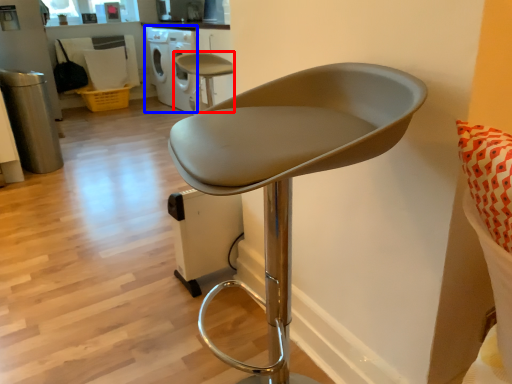
Question: Which of the following is the farthest to the observer, chair (highlighted by a red box) or dish washer (highlighted by a blue box)?

Choices:
 (A) chair
 (B) dish washer

Answer: (B)